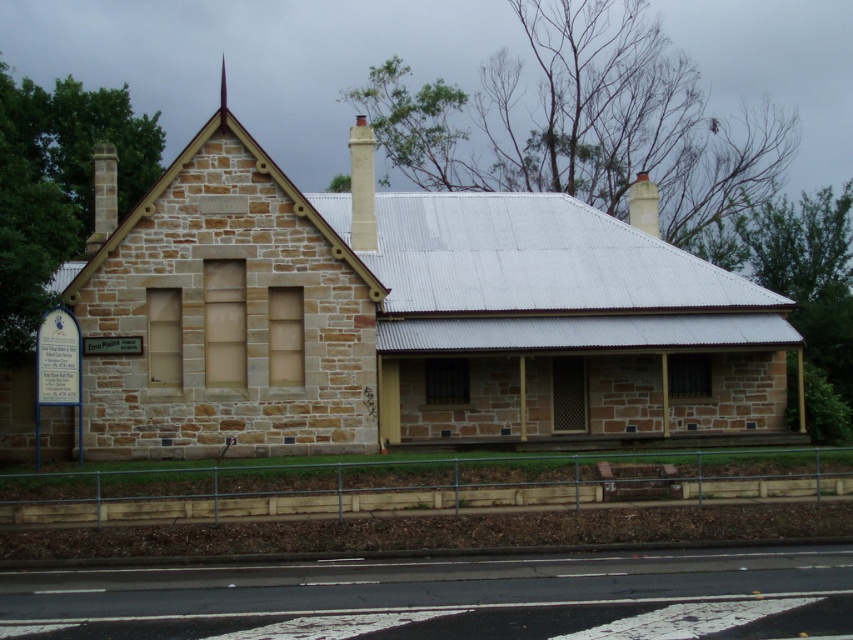
You are standing in front of the brown stone church at center and want to see the white stone chimney at upper center. Can you see it clearly from your current position?

The brown stone church at center is in front of the white stone chimney at upper center, so the church may block the view of the chimney from your current position.

You are standing in front of the brown stone church at center and the white stone chimney at center. Which object is closer to you?

The brown stone church at center is closer to you since it is in front of the white stone chimney at center.